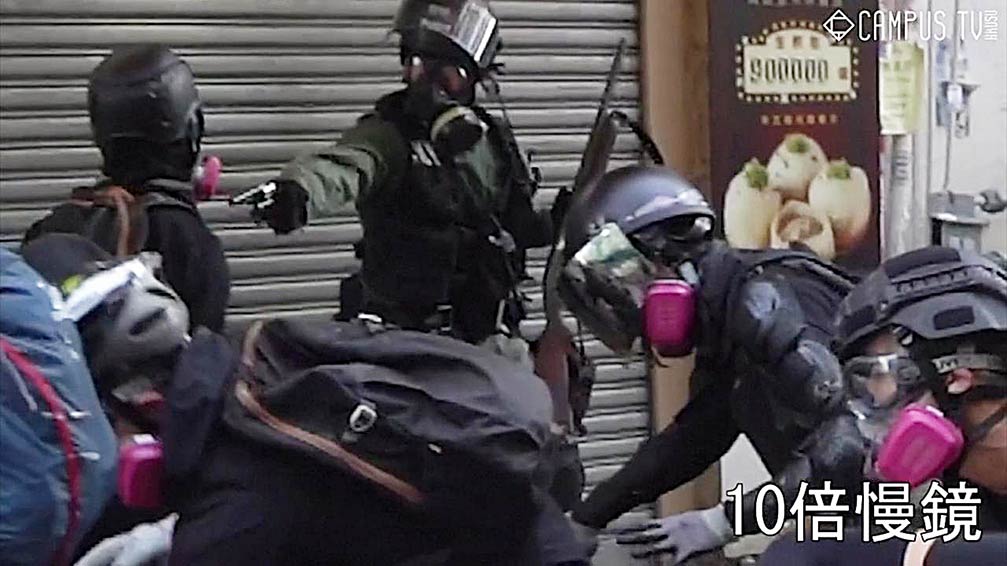
At what (x,y) coordinates should I click in order to perform the action: click on wall. Please return your answer as a coordinate pair (x, y). The image size is (1007, 566). Looking at the image, I should click on (988, 140).